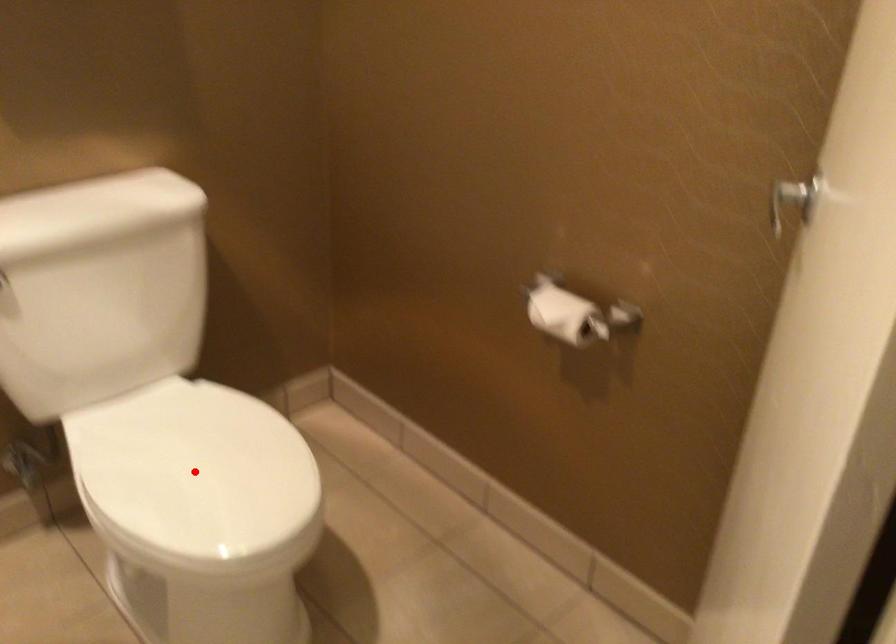
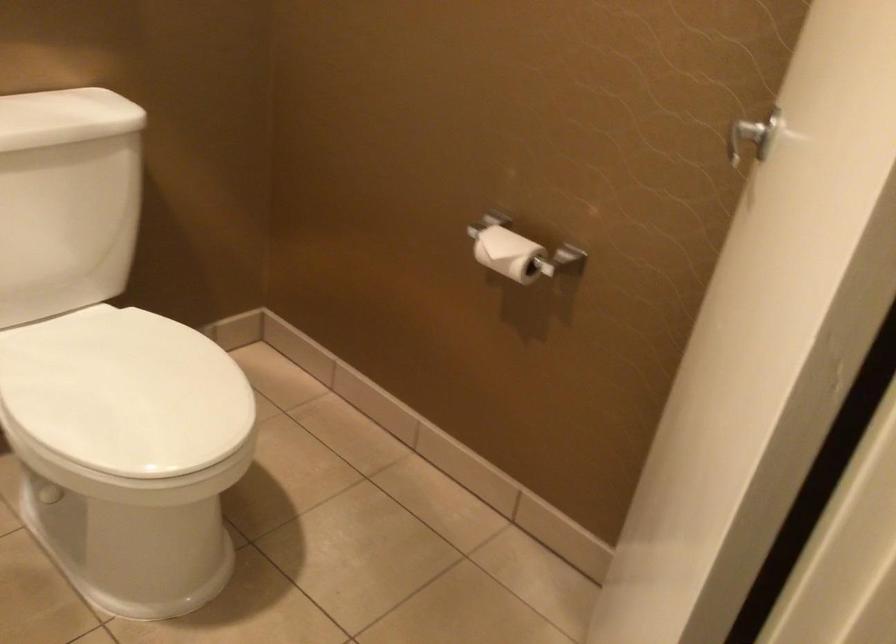
Find the pixel in the second image that matches the highlighted location in the first image.

(125, 393)